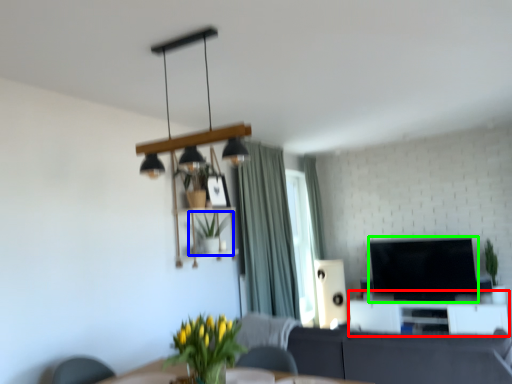
Question: Which is farther away from entertainment center (highlighted by a red box)? houseplant (highlighted by a blue box) or television (highlighted by a green box)?

Choices:
 (A) houseplant
 (B) television

Answer: (A)